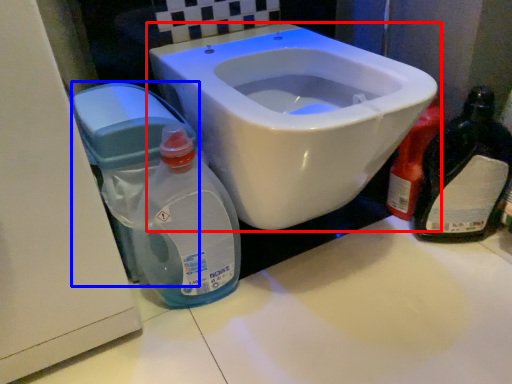
Question: Which object is further to the camera taking this photo, toilet (highlighted by a red box) or water tank (highlighted by a blue box)?

Choices:
 (A) toilet
 (B) water tank

Answer: (B)